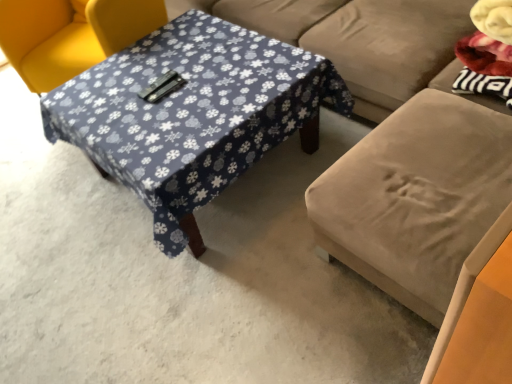
Locate an element on the screen. velvet beige studio couch at center is located at coordinates (397, 139).

What is the approximate height of blue fabric-covered table at center?

The height of blue fabric-covered table at center is 11.21 inches.

The height and width of the screenshot is (384, 512). I want to click on blue fabric-covered table at center, so click(191, 113).

Where is `yellow fabric chair at upper left`? Image resolution: width=512 pixels, height=384 pixels. yellow fabric chair at upper left is located at coordinates (70, 35).

Find the location of `velvet beige studio couch at center`. velvet beige studio couch at center is located at coordinates (397, 139).

Measure the distance between yellow fabric chair at upper left and velvet beige studio couch at center.

38.45 inches.

Can you confirm if yellow fabric chair at upper left is smaller than velvet beige studio couch at center?

Yes, yellow fabric chair at upper left is smaller than velvet beige studio couch at center.

Which object is more forward, yellow fabric chair at upper left or velvet beige studio couch at center?

velvet beige studio couch at center is more forward.

Is yellow fabric chair at upper left outside of velvet beige studio couch at center?

No, yellow fabric chair at upper left is not outside of velvet beige studio couch at center.

From the image's perspective, is velvet beige studio couch at center under yellow fabric chair at upper left?

Yes.

Can you confirm if velvet beige studio couch at center is positioned to the right of yellow fabric chair at upper left?

Yes.

Can yellow fabric chair at upper left be found inside velvet beige studio couch at center?

That's correct, yellow fabric chair at upper left is inside velvet beige studio couch at center.

Is velvet beige studio couch at center far from yellow fabric chair at upper left?

No, there isn't a large distance between velvet beige studio couch at center and yellow fabric chair at upper left.

Is velvet beige studio couch at center aimed at blue fabric-covered table at center?

Yes, velvet beige studio couch at center is aimed at blue fabric-covered table at center.

Can you confirm if velvet beige studio couch at center is positioned to the left of blue fabric-covered table at center?

No, velvet beige studio couch at center is not to the left of blue fabric-covered table at center.

Between point (356, 265) and point (258, 132), which one is positioned in front?

The point (356, 265) is closer.

From a real-world perspective, is velvet beige studio couch at center beneath blue fabric-covered table at center?

Actually, velvet beige studio couch at center is physically above blue fabric-covered table at center in the real world.

Are yellow fabric chair at upper left and blue fabric-covered table at center located far from each other?

yellow fabric chair at upper left is actually quite close to blue fabric-covered table at center.

Is point (22, 27) closer to camera compared to point (225, 61)?

No, (22, 27) is further to viewer.

Is yellow fabric chair at upper left not within blue fabric-covered table at center?

That's correct, yellow fabric chair at upper left is outside of blue fabric-covered table at center.

Considering the positions of objects blue fabric-covered table at center and velvet beige studio couch at center in the image provided, who is more to the right, blue fabric-covered table at center or velvet beige studio couch at center?

velvet beige studio couch at center.

Is blue fabric-covered table at center further to camera compared to velvet beige studio couch at center?

Yes, it is.

Does blue fabric-covered table at center turn towards velvet beige studio couch at center?

Yes.

Considering the sizes of objects blue fabric-covered table at center and velvet beige studio couch at center in the image provided, who is taller, blue fabric-covered table at center or velvet beige studio couch at center?

velvet beige studio couch at center is taller.

From the image's perspective, would you say blue fabric-covered table at center is positioned over yellow fabric chair at upper left?

No, from the image's perspective, blue fabric-covered table at center is not above yellow fabric chair at upper left.

From a real-world perspective, is blue fabric-covered table at center positioned over yellow fabric chair at upper left based on gravity?

No, from a real-world perspective, blue fabric-covered table at center is not above yellow fabric chair at upper left.

Is there a large distance between blue fabric-covered table at center and yellow fabric chair at upper left?

No, blue fabric-covered table at center is not far from yellow fabric chair at upper left.

Image resolution: width=512 pixels, height=384 pixels. In order to click on chair on the left of velvet beige studio couch at center in this screenshot , I will do `click(70, 35)`.

The height and width of the screenshot is (384, 512). What are the coordinates of `studio couch on the right of yellow fabric chair at upper left` in the screenshot? It's located at (397, 139).

Estimate the real-world distances between objects in this image. Which object is further from blue fabric-covered table at center, yellow fabric chair at upper left or velvet beige studio couch at center?

yellow fabric chair at upper left.

Considering their positions, is yellow fabric chair at upper left positioned further to velvet beige studio couch at center than blue fabric-covered table at center?

The object further to velvet beige studio couch at center is yellow fabric chair at upper left.

From the image, which object appears to be farther from yellow fabric chair at upper left, velvet beige studio couch at center or blue fabric-covered table at center?

Among the two, velvet beige studio couch at center is located further to yellow fabric chair at upper left.

When comparing their distances from blue fabric-covered table at center, does velvet beige studio couch at center or yellow fabric chair at upper left seem further?

yellow fabric chair at upper left is positioned further to the anchor blue fabric-covered table at center.

Based on their spatial positions, is blue fabric-covered table at center or yellow fabric chair at upper left further from velvet beige studio couch at center?

yellow fabric chair at upper left is further to velvet beige studio couch at center.

When comparing their distances from yellow fabric chair at upper left, does blue fabric-covered table at center or velvet beige studio couch at center seem closer?

The object closer to yellow fabric chair at upper left is blue fabric-covered table at center.

You are a GUI agent. You are given a task and a screenshot of the screen. Output one action in this format:
    pyautogui.click(x=<x>, y=<y>)
    Task: Click on the table between velvet beige studio couch at center and yellow fabric chair at upper left along the z-axis
    
    Given the screenshot: What is the action you would take?
    pyautogui.click(x=191, y=113)